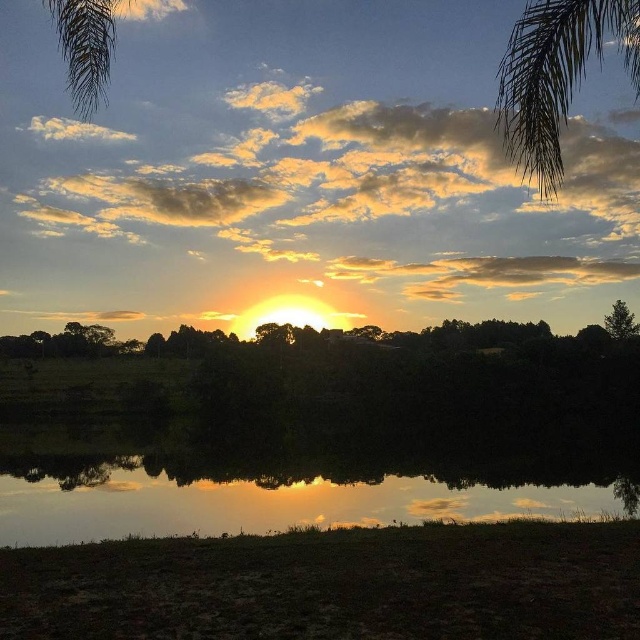
You are standing in the sunset scene and want to determine the relative positions of two points marked in the image. Which point is closer to you, point (104,67) or point (611,314)?

Point (104,67) is in front of point (611,314), so it is closer to you.